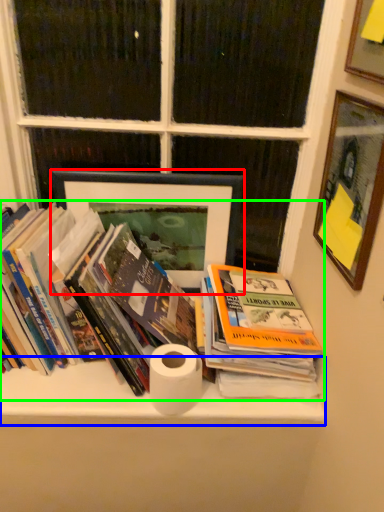
Question: Which object is the farthest from picture frame (highlighted by a red box)? Choose among these: shelf (highlighted by a blue box) or book (highlighted by a green box).

Choices:
 (A) shelf
 (B) book

Answer: (A)